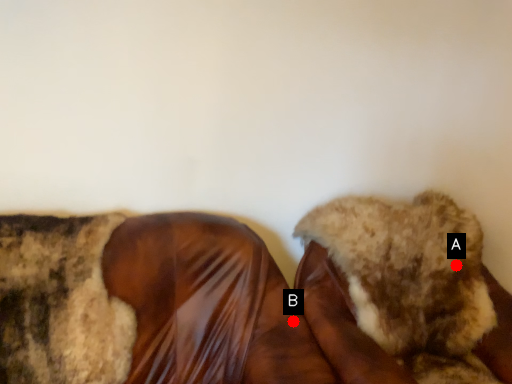
Question: Two points are circled on the image, labeled by A and B beside each circle. Which point is farther to the camera?

Choices:
 (A) A is further
 (B) B is further

Answer: (A)